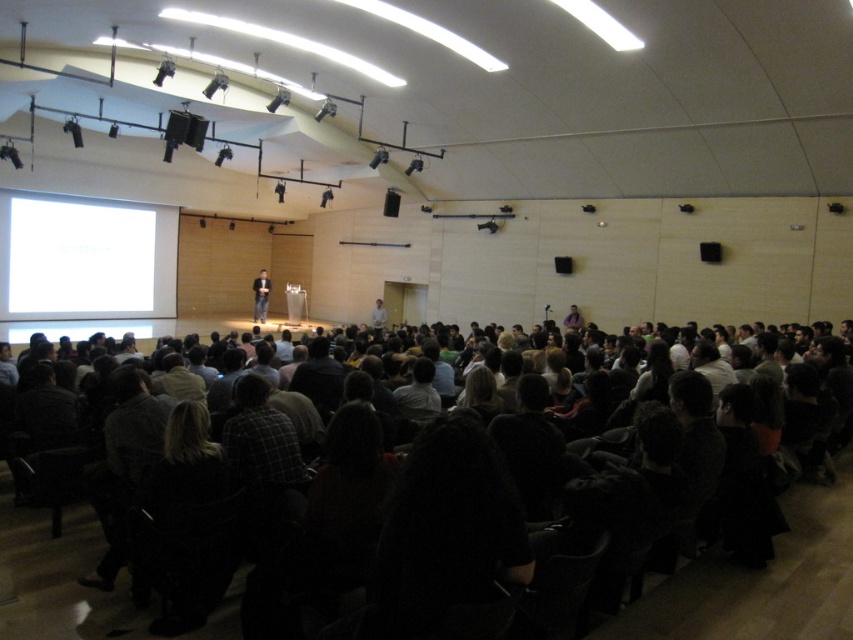
Does white glossy projection screen at left lie behind dark suit at center?

No.

Is point (15, 200) more distant than point (265, 301)?

That is False.

You are a GUI agent. You are given a task and a screenshot of the screen. Output one action in this format:
    pyautogui.click(x=<x>, y=<y>)
    Task: Click on the white glossy projection screen at left
    The image size is (853, 640).
    Given the screenshot: What is the action you would take?
    pyautogui.click(x=85, y=259)

How much distance is there between dark clothing crowd at center and dark suit at center?

14.71 meters

Which is behind, point (831, 484) or point (265, 296)?

The point (265, 296) is behind.

Who is more distant from viewer, (639, 621) or (260, 312)?

Positioned behind is point (260, 312).

What are the coordinates of `dark clothing crowd at center` in the screenshot? It's located at (759, 580).

Does dark clothing crowd at center have a greater height compared to white glossy projection screen at left?

No.

Does dark clothing crowd at center have a greater width compared to white glossy projection screen at left?

No.

At what (x,y) coordinates should I click in order to perform the action: click on dark clothing crowd at center. Please return your answer as a coordinate pair (x, y). Image resolution: width=853 pixels, height=640 pixels. Looking at the image, I should click on tap(759, 580).